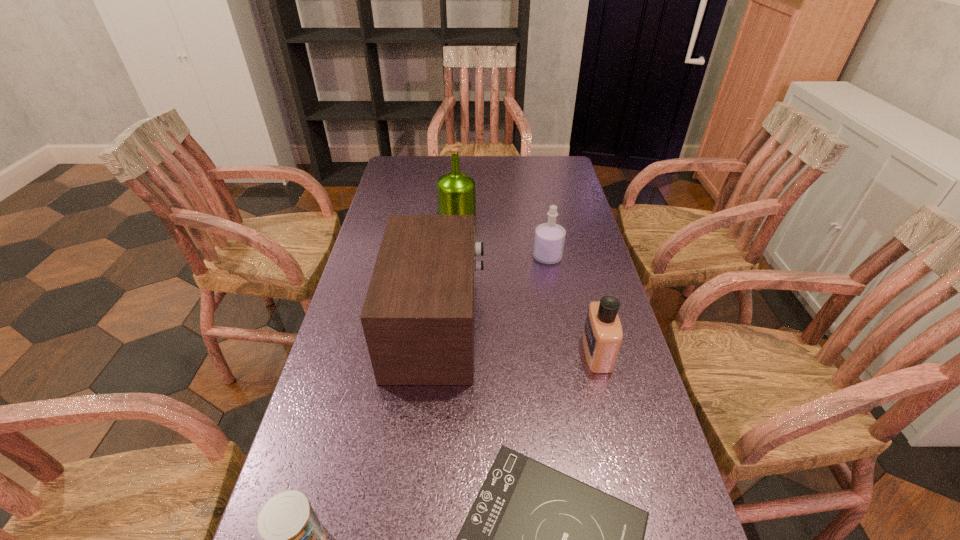
Locate an element on the screen. free space located on the front label of the right perfume is located at coordinates (502, 353).

This screenshot has height=540, width=960. I want to click on object that is at the left edge, so click(418, 318).

Where is `blank space at the far edge of the desktop`? This screenshot has height=540, width=960. blank space at the far edge of the desktop is located at coordinates (491, 185).

Locate an element on the screen. The width and height of the screenshot is (960, 540). free space at the left edge of the desktop is located at coordinates (403, 190).

The width and height of the screenshot is (960, 540). I want to click on vacant space at the right edge of the desktop, so click(589, 454).

Locate an element on the screen. Image resolution: width=960 pixels, height=540 pixels. blank area at the far left corner is located at coordinates (412, 160).

In order to click on vacant space at the far right corner of the desktop in this screenshot , I will do `click(564, 176)`.

You are a GUI agent. You are given a task and a screenshot of the screen. Output one action in this format:
    pyautogui.click(x=<x>, y=<y>)
    Task: Click on the vacant space that is in between the fifth nearest object and the farthest object
    This screenshot has width=960, height=540.
    Given the screenshot: What is the action you would take?
    pyautogui.click(x=502, y=234)

The width and height of the screenshot is (960, 540). What are the coordinates of `blank region between the fifth nearest object and the radio receiver` in the screenshot? It's located at (492, 292).

Select which object appears as the third closest to the right perfume. Please provide its 2D coordinates. Your answer should be formatted as a tuple, i.e. [(x, y)], where the tuple contains the x and y coordinates of a point satisfying the conditions above.

[(549, 240)]